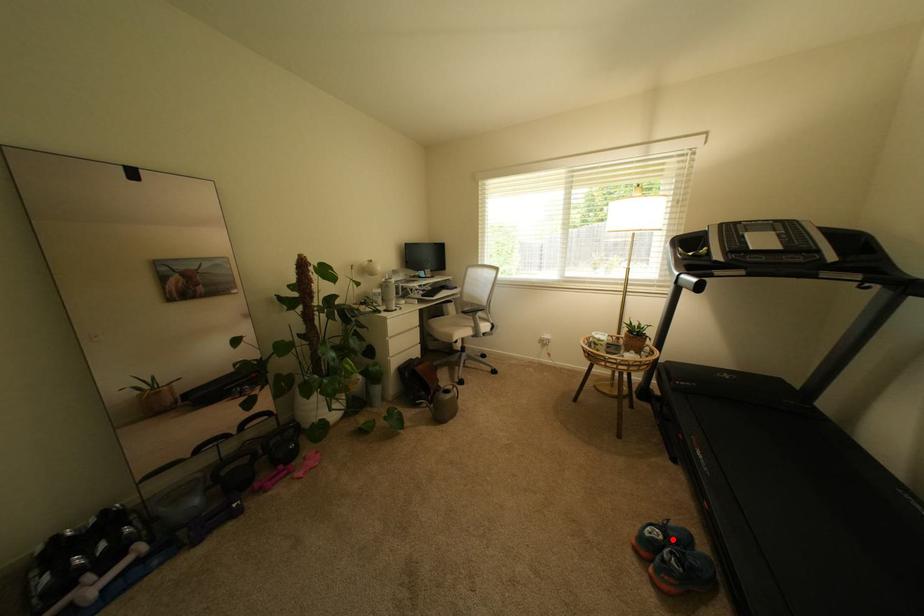
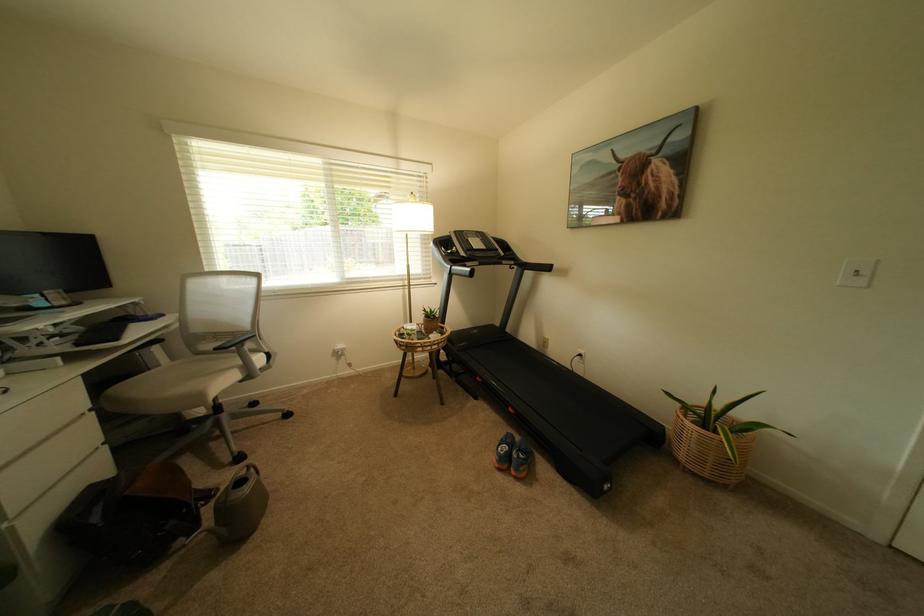
Locate, in the second image, the point that corresponds to the highlighted location in the first image.

(517, 448)